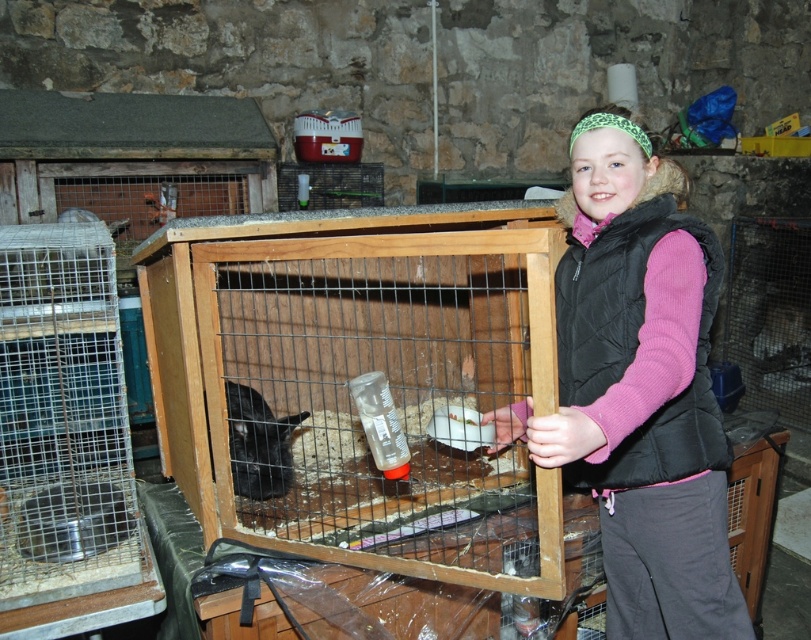
The scene shows a young girl wearing a black quilted vest at center and holding a black fur rabbit at center. Which object is bigger in size?

The black quilted vest at center is larger in size compared to the black fur rabbit at center.

The black quilted vest at center and the black fur rabbit at center are both at the center of the image. How far apart are they from each other?

The black quilted vest at center and the black fur rabbit at center are 32.37 inches apart from each other.